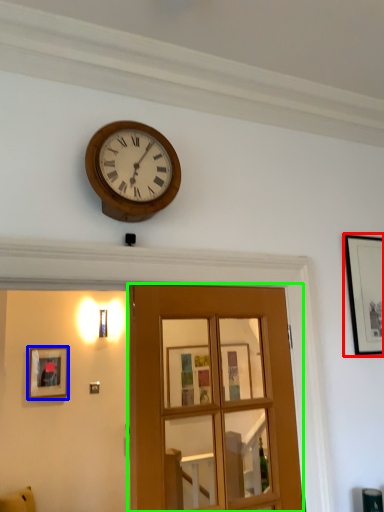
Question: Considering the real-world distances, which object is farthest from picture frame (highlighted by a red box)? picture frame (highlighted by a blue box) or door (highlighted by a green box)?

Choices:
 (A) picture frame
 (B) door

Answer: (A)